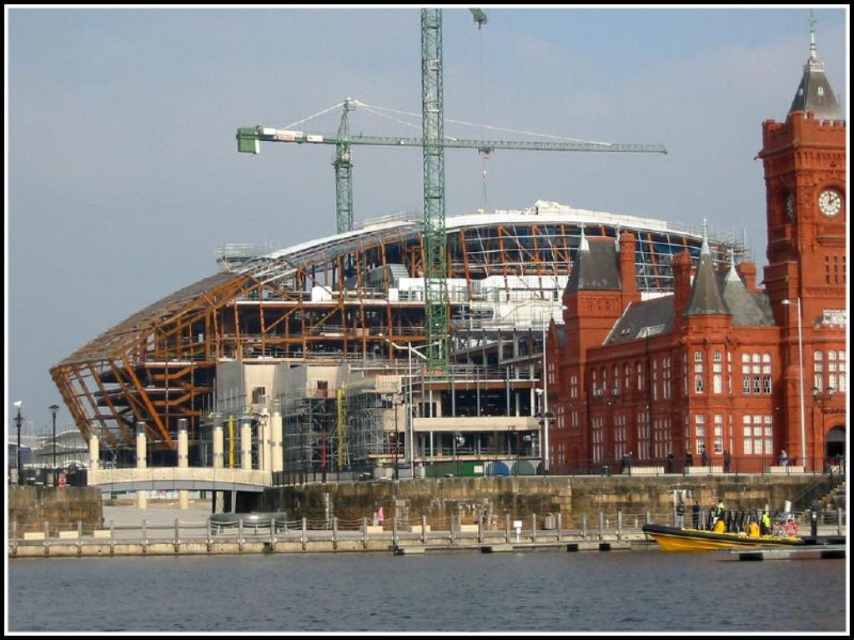
Is red brick clock tower at upper right further to camera compared to yellow rubber boat at lower center?

Yes, red brick clock tower at upper right is further from the viewer.

Which is above, red brick clock tower at upper right or yellow rubber boat at lower center?

Positioned higher is red brick clock tower at upper right.

Does point (784, 372) lie in front of point (722, 545)?

That is False.

Locate an element on the screen. red brick clock tower at upper right is located at coordinates (806, 264).

Which is behind, point (483, 595) or point (706, 531)?

The point (706, 531) is behind.

Which is more to the left, transparent water at lower center or yellow rubber boat at lower center?

From the viewer's perspective, transparent water at lower center appears more on the left side.

Is point (793, 605) more distant than point (779, 541)?

No, (793, 605) is closer to viewer.

The height and width of the screenshot is (640, 854). Find the location of `transparent water at lower center`. transparent water at lower center is located at coordinates (425, 593).

Which is below, transparent water at lower center or green metal crane at center?

transparent water at lower center

Is point (244, 598) closer to viewer compared to point (347, 228)?

Yes, it is in front of point (347, 228).

What do you see at coordinates (425, 593) in the screenshot? The height and width of the screenshot is (640, 854). I see `transparent water at lower center` at bounding box center [425, 593].

At what (x,y) coordinates should I click in order to perform the action: click on transparent water at lower center. Please return your answer as a coordinate pair (x, y). The height and width of the screenshot is (640, 854). Looking at the image, I should click on (425, 593).